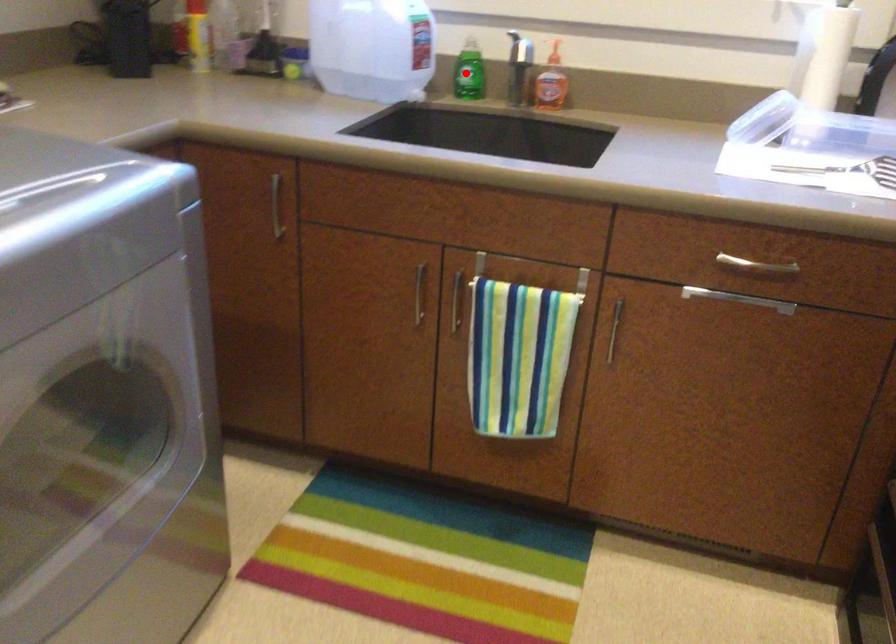
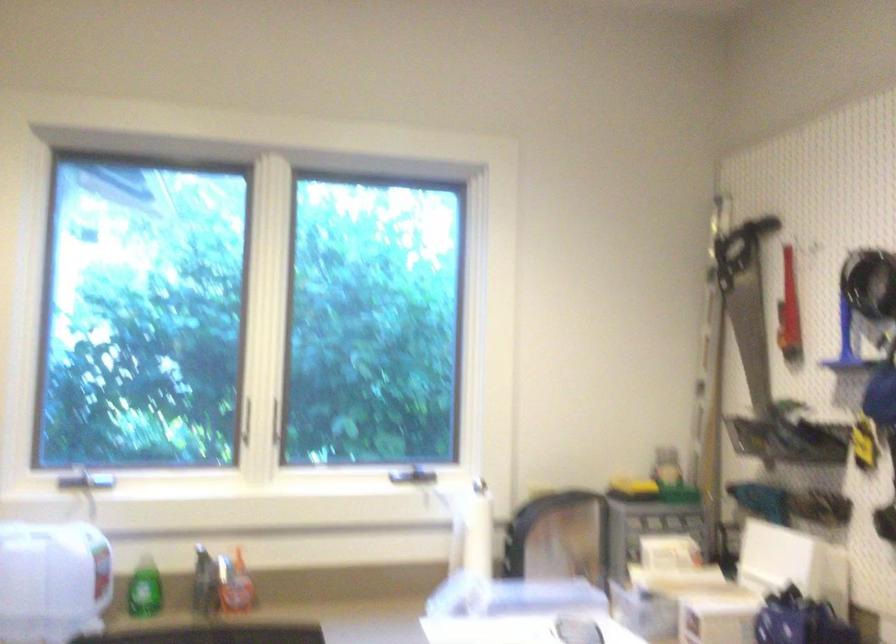
Find the pixel in the second image that matches the highlighted location in the first image.

(143, 589)